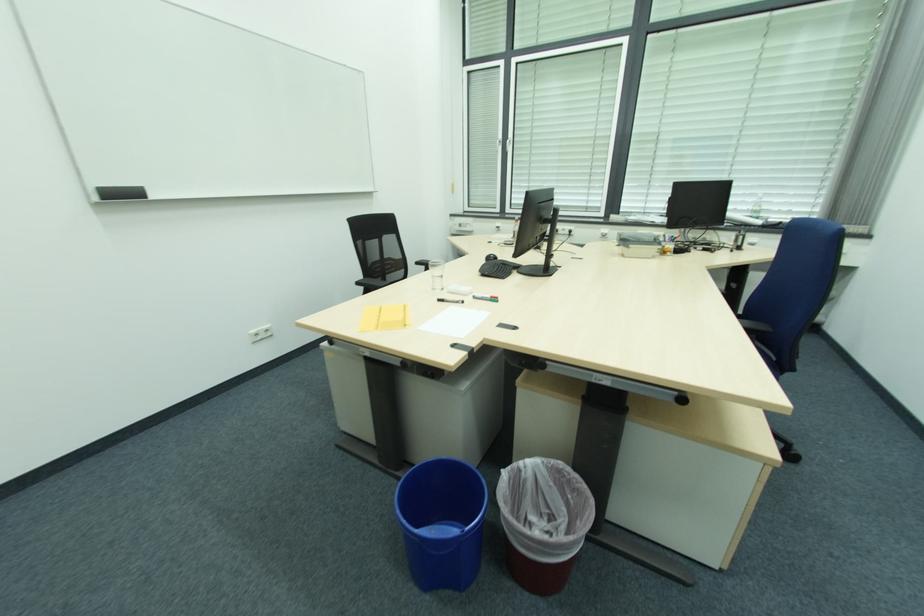
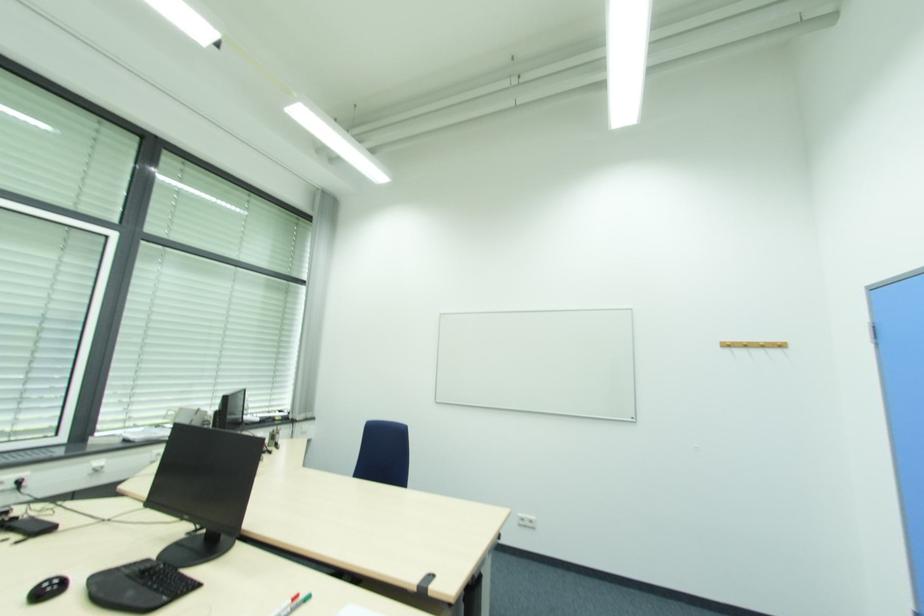
In the second image, find the point that corresponds to (570,233) in the first image.

(17, 487)